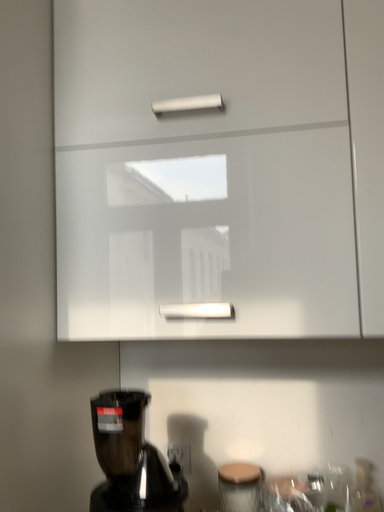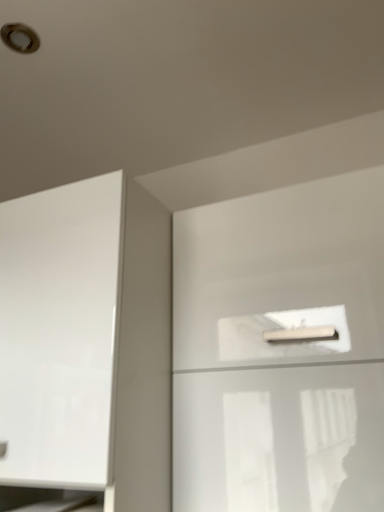
Question: How did the camera likely rotate when shooting the video?

Choices:
 (A) rotated downward
 (B) rotated upward

Answer: (B)